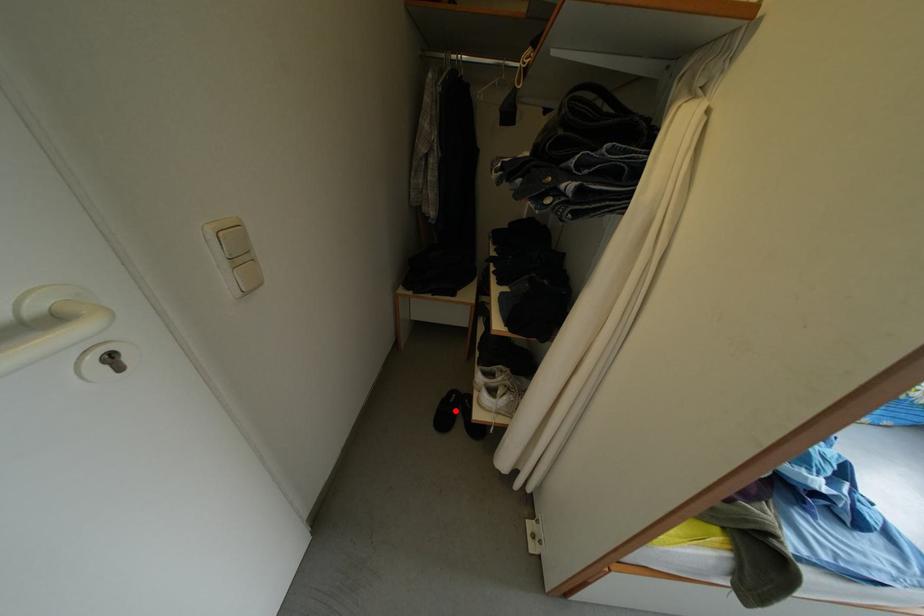
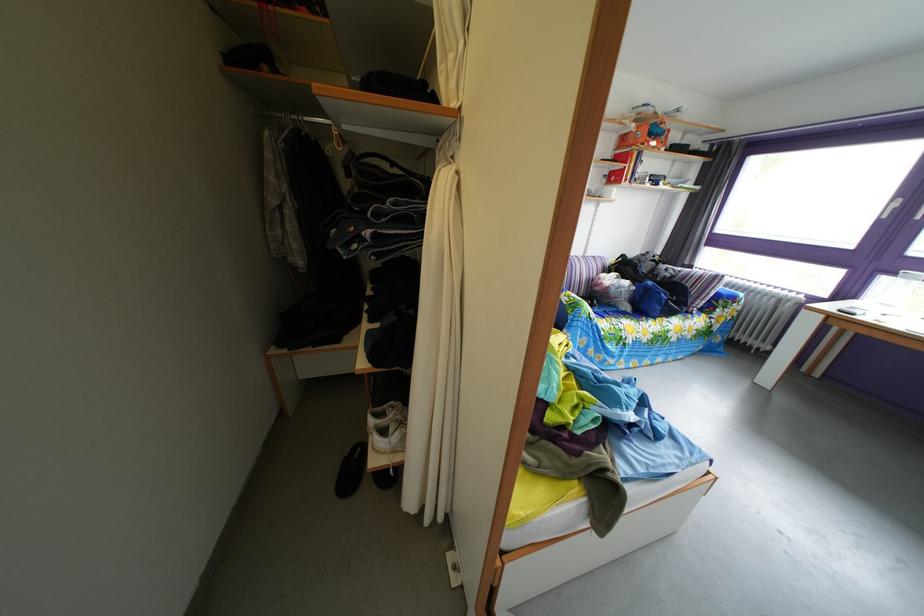
Question: I am providing you with two images of the same scene from different viewpoints. In image1, a red point is highlighted. Considering the same 3D point in image2, which of the following is correct?

Choices:
 (A) It is closer
 (B) It is farther

Answer: (B)